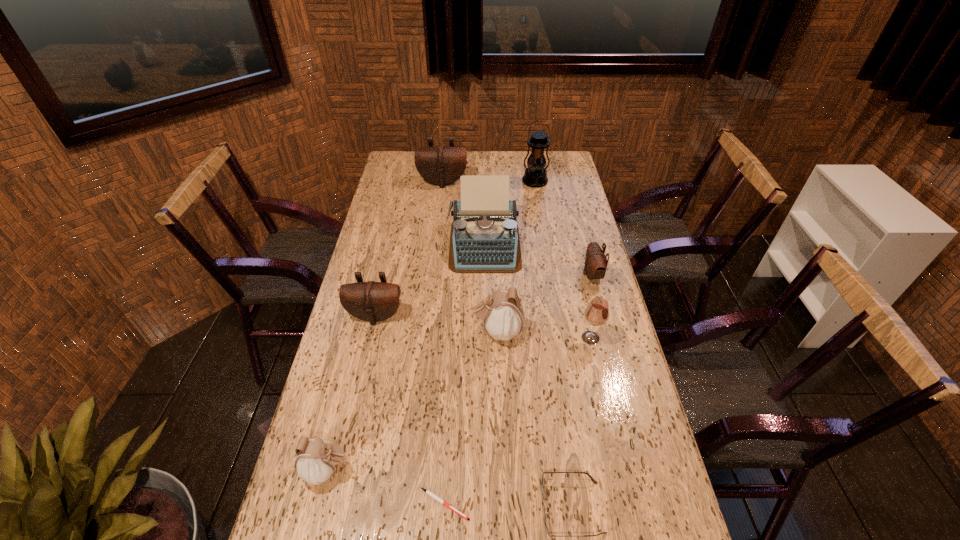
The width and height of the screenshot is (960, 540). In order to click on lantern that is positioned at the right edge in this screenshot , I will do `click(535, 175)`.

Locate an element on the screen. This screenshot has width=960, height=540. wineglass located at the right edge is located at coordinates (596, 313).

Find the location of a particular element. Image resolution: width=960 pixels, height=540 pixels. pouch that is at the right edge is located at coordinates (596, 262).

Where is `object that is at the far left corner`? This screenshot has height=540, width=960. object that is at the far left corner is located at coordinates (440, 165).

At what (x,y) coordinates should I click in order to perform the action: click on object at the far right corner. Please return your answer as a coordinate pair (x, y). This screenshot has height=540, width=960. Looking at the image, I should click on (535, 175).

In the image, there is a desktop. At what (x,y) coordinates should I click in order to perform the action: click on vacant space at the left edge. Please return your answer as a coordinate pair (x, y). Looking at the image, I should click on (345, 312).

Where is `free space at the right edge`? free space at the right edge is located at coordinates (631, 474).

In the image, there is a desktop. In order to click on vacant region at the far left corner in this screenshot , I will do 395,168.

At what (x,y) coordinates should I click in order to perform the action: click on free space that is in between the typewriter and the second farthest pouch. Please return your answer as a coordinate pair (x, y). Looking at the image, I should click on (539, 259).

Locate an element on the screen. This screenshot has width=960, height=540. vacant space that's between the blue typewriter and the right white pouch is located at coordinates (491, 288).